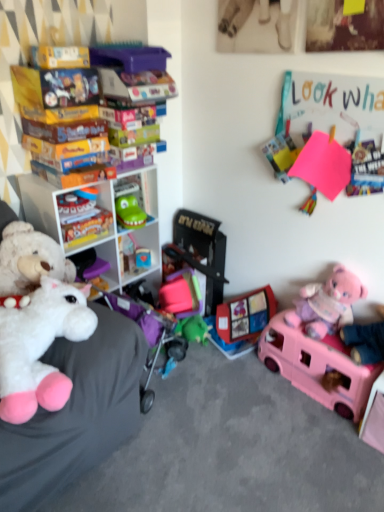
The width and height of the screenshot is (384, 512). Describe the element at coordinates (242, 321) in the screenshot. I see `matte plastic toy at center, acting as the second toy starting from the right` at that location.

This screenshot has height=512, width=384. What do you see at coordinates (108, 225) in the screenshot?
I see `white plastic shelf at left, placed as the 1th shelf when sorted from bottom to top` at bounding box center [108, 225].

Locate an element on the screen. The image size is (384, 512). smooth plastic toy at center, which ranks as the second toy in left-to-right order is located at coordinates (143, 257).

Locate an element on the screen. soft gray bean bag at left is located at coordinates (76, 414).

From a real-world perspective, which is physically below, matte plastic toy at left, which is the 5th toy in right-to-left order, or pink plastic toy car at lower right, positioned as the first toy in right-to-left order?

pink plastic toy car at lower right, positioned as the first toy in right-to-left order, is physically lower.

Is matte plastic toy at left, arranged as the 1th toy when viewed from the left, positioned in front of pink plastic toy car at lower right, positioned as the first toy in right-to-left order?

No, matte plastic toy at left, arranged as the 1th toy when viewed from the left, is behind pink plastic toy car at lower right, positioned as the first toy in right-to-left order.

Is pink plastic toy car at lower right, positioned as the first toy in right-to-left order, surrounded by matte plastic toy at left, arranged as the 1th toy when viewed from the left?

Definitely not — pink plastic toy car at lower right, positioned as the first toy in right-to-left order, is not inside matte plastic toy at left, arranged as the 1th toy when viewed from the left.

Which is more to the left, matte plastic toy at left, arranged as the 1th toy when viewed from the left, or pink plastic toy car at lower right, positioned as the first toy in right-to-left order?

Positioned to the left is matte plastic toy at left, arranged as the 1th toy when viewed from the left.

Visually, is matte pink paper at upper right positioned to the left or to the right of green plastic toy at center, which is the 2th shelf from bottom to top?

matte pink paper at upper right is positioned on green plastic toy at center, which is the 2th shelf from bottom to top,'s right side.

Could you tell me if matte pink paper at upper right is turned towards green plastic toy at center, which is the 1th shelf in top-to-bottom order?

No, matte pink paper at upper right is not oriented towards green plastic toy at center, which is the 1th shelf in top-to-bottom order.

From the image's perspective, is matte pink paper at upper right located beneath green plastic toy at center, which is the 1th shelf in top-to-bottom order?

No, from the image's perspective, matte pink paper at upper right is not below green plastic toy at center, which is the 1th shelf in top-to-bottom order.

Considering the sizes of matte pink paper at upper right and green plastic toy at center, which is the 2th shelf from bottom to top, in the image, is matte pink paper at upper right bigger or smaller than green plastic toy at center, which is the 2th shelf from bottom to top,?

Considering their sizes, matte pink paper at upper right takes up less space than green plastic toy at center, which is the 2th shelf from bottom to top.

Considering the sizes of objects smooth plastic toy at center, the 4th toy when ordered from right to left, and matte plastic toy at left, which is the 5th toy in right-to-left order, in the image provided, who is thinner, smooth plastic toy at center, the 4th toy when ordered from right to left, or matte plastic toy at left, which is the 5th toy in right-to-left order,?

smooth plastic toy at center, the 4th toy when ordered from right to left, is thinner.

From a real-world perspective, is smooth plastic toy at center, which ranks as the second toy in left-to-right order, physically above matte plastic toy at left, arranged as the 1th toy when viewed from the left?

No.

Can you confirm if smooth plastic toy at center, which ranks as the second toy in left-to-right order, is taller than matte plastic toy at left, arranged as the 1th toy when viewed from the left?

No, smooth plastic toy at center, which ranks as the second toy in left-to-right order, is not taller than matte plastic toy at left, arranged as the 1th toy when viewed from the left.

Is plastic toy car at center, which is counted as the third toy, starting from the right, not inside matte plastic toy at center, acting as the second toy starting from the right?

plastic toy car at center, which is counted as the third toy, starting from the right, lies outside matte plastic toy at center, acting as the second toy starting from the right,'s area.

Can you confirm if plastic toy car at center, the third toy from the left, is thinner than matte plastic toy at center, acting as the second toy starting from the right?

Correct, the width of plastic toy car at center, the third toy from the left, is less than that of matte plastic toy at center, acting as the second toy starting from the right.

Does plastic toy car at center, which is counted as the third toy, starting from the right, touch matte plastic toy at center, the 4th toy from the left?

There is a gap between plastic toy car at center, which is counted as the third toy, starting from the right, and matte plastic toy at center, the 4th toy from the left.

Consider the image. Is matte plastic toy at left, arranged as the 1th toy when viewed from the left, facing away from plastic toy car at center, which is counted as the third toy, starting from the right?

matte plastic toy at left, arranged as the 1th toy when viewed from the left, is not turned away from plastic toy car at center, which is counted as the third toy, starting from the right.

Between matte plastic toy at left, which is the 5th toy in right-to-left order, and plastic toy car at center, the third toy from the left, which one has less height?

With less height is matte plastic toy at left, which is the 5th toy in right-to-left order.

The width and height of the screenshot is (384, 512). I want to click on the 2nd toy below the matte plastic toy at left, which is the 5th toy in right-to-left order (from the image's perspective), so click(181, 294).

From a real-world perspective, which object stands above the other?

matte plastic toy at left, which is the 5th toy in right-to-left order, is physically above.

Which object is thinner, white plastic shelf at left, placed as the 1th shelf when sorted from bottom to top, or soft gray bean bag at left?

With smaller width is white plastic shelf at left, placed as the 1th shelf when sorted from bottom to top.

From the image's perspective, is white plastic shelf at left, placed as the 1th shelf when sorted from bottom to top, located above or below soft gray bean bag at left?

white plastic shelf at left, placed as the 1th shelf when sorted from bottom to top, is situated higher than soft gray bean bag at left in the image.

Is soft gray bean bag at left at the back of white plastic shelf at left, placed as the second shelf when sorted from top to bottom?

No, soft gray bean bag at left is not at the back of white plastic shelf at left, placed as the second shelf when sorted from top to bottom.

Which object is further away from the camera, green plastic toy at center, which is the 1th shelf in top-to-bottom order, or matte plastic toy at left, which is the 5th toy in right-to-left order?

green plastic toy at center, which is the 1th shelf in top-to-bottom order, is further from the camera.

In order to click on shelf located above the matte plastic toy at left, arranged as the 1th toy when viewed from the left (from a real-world perspective) in this screenshot , I will do `click(136, 199)`.

Consider the image. Which is more to the right, green plastic toy at center, which is the 2th shelf from bottom to top, or matte plastic toy at left, arranged as the 1th toy when viewed from the left?

Positioned to the right is green plastic toy at center, which is the 2th shelf from bottom to top.

You are a GUI agent. You are given a task and a screenshot of the screen. Output one action in this format:
    pyautogui.click(x=<x>, y=<y>)
    Task: Click on the 1st toy behind the pink plastic toy car at lower right, positioned as the first toy in right-to-left order
    The width and height of the screenshot is (384, 512).
    Given the screenshot: What is the action you would take?
    pyautogui.click(x=81, y=217)

Which shelf is the 1st one when counting from the left side of the matte pink paper at upper right? Please provide its 2D coordinates.

[(136, 199)]

Which object lies nearer to the anchor point white plastic shelf at left, placed as the 1th shelf when sorted from bottom to top, green plastic toy at center, which is the 1th shelf in top-to-bottom order, or matte pink paper at upper right?

green plastic toy at center, which is the 1th shelf in top-to-bottom order.

Considering their positions, is soft gray bean bag at left positioned closer to matte pink paper at upper right than pink plastic toy car at lower right, which ranks as the fifth toy in left-to-right order?

pink plastic toy car at lower right, which ranks as the fifth toy in left-to-right order, lies closer to matte pink paper at upper right than the other object.

Looking at the image, which one is located further to green plastic toy at center, which is the 2th shelf from bottom to top, matte plastic toy at center, acting as the second toy starting from the right, or smooth plastic toy at center, the 4th toy when ordered from right to left?

Among the two, matte plastic toy at center, acting as the second toy starting from the right, is located further to green plastic toy at center, which is the 2th shelf from bottom to top.

When comparing their distances from matte pink paper at upper right, does pink plastic toy car at lower right, which ranks as the fifth toy in left-to-right order, or matte plastic toy at center, acting as the second toy starting from the right, seem closer?

pink plastic toy car at lower right, which ranks as the fifth toy in left-to-right order, is closer to matte pink paper at upper right.

Based on their spatial positions, is matte plastic toy at left, arranged as the 1th toy when viewed from the left, or matte plastic toy at center, the 4th toy from the left, further from green plastic toy at center, which is the 1th shelf in top-to-bottom order?

matte plastic toy at center, the 4th toy from the left, is further to green plastic toy at center, which is the 1th shelf in top-to-bottom order.

When comparing their distances from matte plastic toy at center, the 4th toy from the left, does matte plastic toy at left, arranged as the 1th toy when viewed from the left, or pink plastic toy car at lower right, positioned as the first toy in right-to-left order, seem closer?

pink plastic toy car at lower right, positioned as the first toy in right-to-left order, lies closer to matte plastic toy at center, the 4th toy from the left, than the other object.

Estimate the real-world distances between objects in this image. Which object is closer to pink plastic toy car at lower right, positioned as the first toy in right-to-left order, matte plastic toy at left, arranged as the 1th toy when viewed from the left, or smooth plastic toy at center, the 4th toy when ordered from right to left?

smooth plastic toy at center, the 4th toy when ordered from right to left, is positioned closer to the anchor pink plastic toy car at lower right, positioned as the first toy in right-to-left order.

Estimate the real-world distances between objects in this image. Which object is further from pink plush teddy bear at lower right, plastic toy car at center, the third toy from the left, or soft gray bean bag at left?

soft gray bean bag at left lies further to pink plush teddy bear at lower right than the other object.

Where is `toy located between plastic toy car at center, the third toy from the left, and pink plastic toy car at lower right, which ranks as the fifth toy in left-to-right order, in the left-right direction`? The width and height of the screenshot is (384, 512). toy located between plastic toy car at center, the third toy from the left, and pink plastic toy car at lower right, which ranks as the fifth toy in left-to-right order, in the left-right direction is located at coordinates (242, 321).

Find the location of a particular element. toy between smooth plastic toy at center, which ranks as the second toy in left-to-right order, and matte plastic toy at center, acting as the second toy starting from the right, from left to right is located at coordinates (181, 294).

Locate an element on the screen. The width and height of the screenshot is (384, 512). shelf between white plastic shelf at left, placed as the 1th shelf when sorted from bottom to top, and matte pink paper at upper right is located at coordinates (136, 199).

Where is `teddy bear between matte pink paper at upper right and plastic toy car at center, the third toy from the left, from front to back`? This screenshot has height=512, width=384. teddy bear between matte pink paper at upper right and plastic toy car at center, the third toy from the left, from front to back is located at coordinates (327, 303).